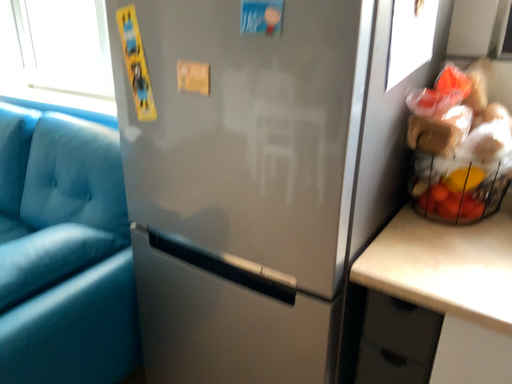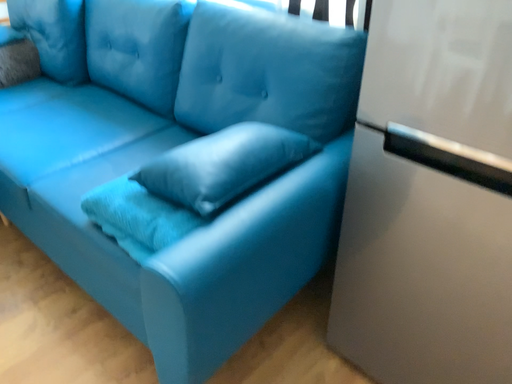
Question: Which way did the camera rotate in the video?

Choices:
 (A) rotated left
 (B) rotated right

Answer: (A)